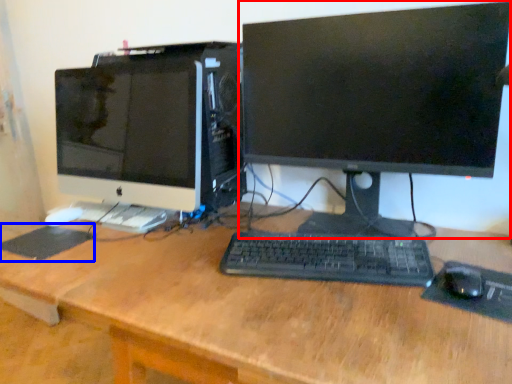
Question: Which object appears closest to the camera in this image, computer monitor (highlighted by a red box) or mousepad (highlighted by a blue box)?

Choices:
 (A) computer monitor
 (B) mousepad

Answer: (A)